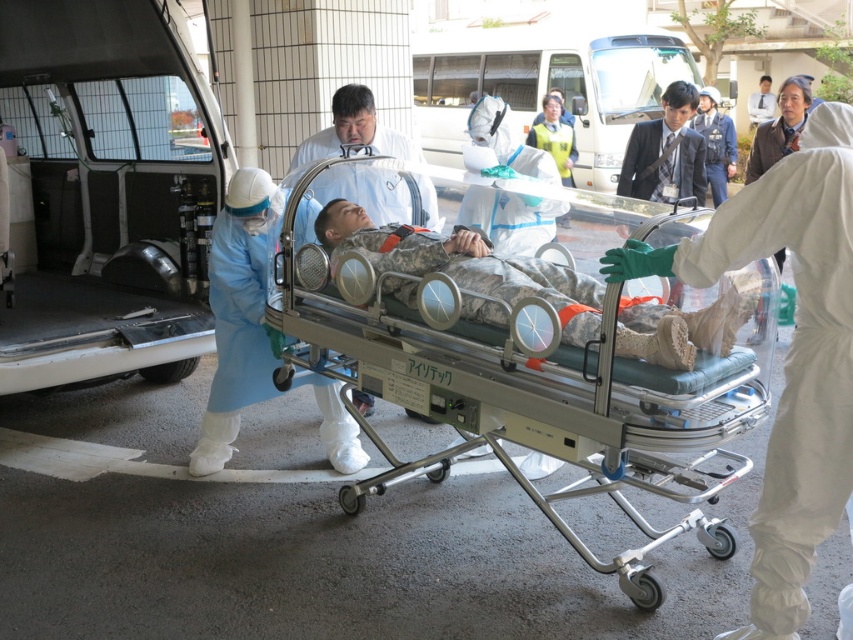
You are a medical staff member observing the silver metallic stretcher at center and the camouflage fabric baby at center. Which object is positioned lower in the scene?

The silver metallic stretcher at center is located below the camouflage fabric baby at center, so the stretcher is positioned lower.

You are a medical staff member assigned to ensure the safety of the silver metallic stretcher at center and the camouflage fabric baby at center during transport. Considering their sizes, which object requires more space to maneuver? Please explain your reasoning.

The silver metallic stretcher at center requires more space to maneuver because it is bigger than the camouflage fabric baby at center.

You are a medical staff member assigned to assist in moving the silver metallic stretcher at center and the camouflage fabric baby at center. Based on their positions, which object should you prioritize moving first?

The silver metallic stretcher at center should be prioritized because it is in front of the camouflage fabric baby at center, indicating it needs immediate attention.